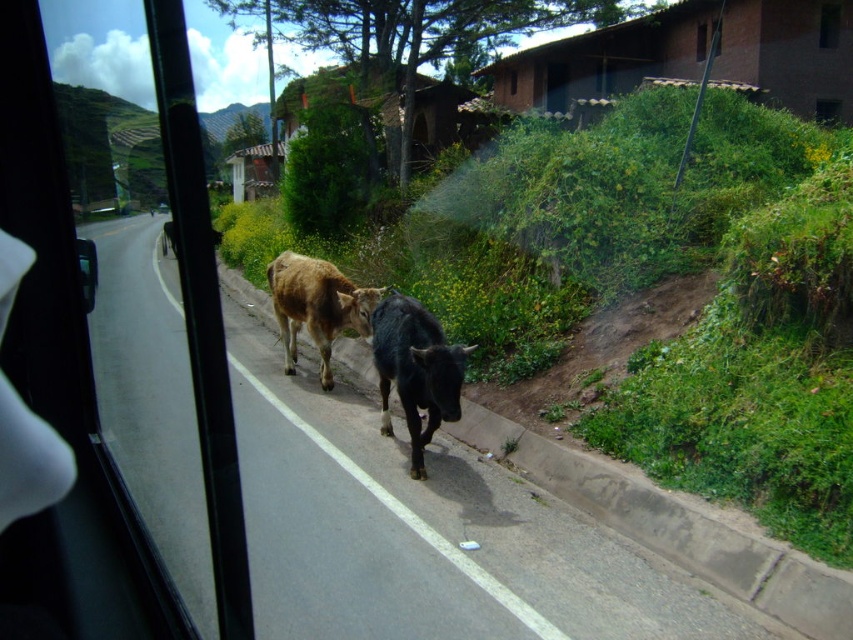
You are a passenger in a bus and looking out the window. You see a point marked at coordinate (415, 371). What object is located at this point?

The point at coordinate (415, 371) corresponds to the black glossy cow at center.

You are driving a car with a passenger seat next to the transparent glass car window at left. You want to safely pass the black glossy cow at center on the road. Considering the distance between them, is there enough space to maneuver around the cow without getting too close?

→ The distance between the transparent glass car window at left and the black glossy cow at center is 10.39 meters. Since the cow is on the road edge and the road has two lanes, there is sufficient space to safely maneuver around the cow while maintaining a safe distance.